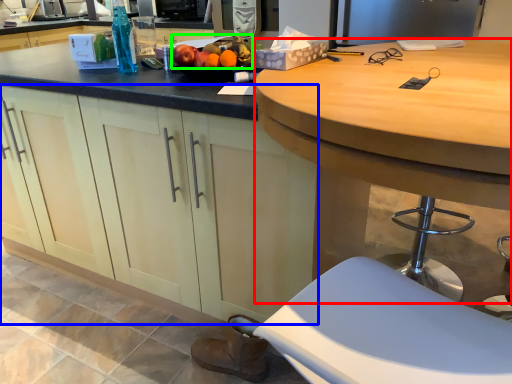
Question: Which is farther away from desk (highlighted by a red box)? cabinetry (highlighted by a blue box) or fruit (highlighted by a green box)?

Choices:
 (A) cabinetry
 (B) fruit

Answer: (B)